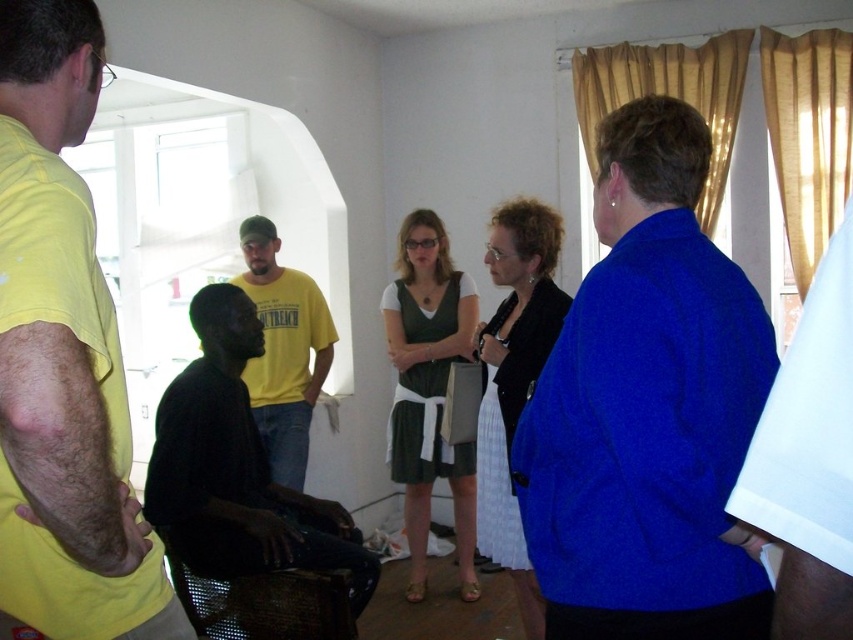
Is yellow matte shirt at left shorter than matte green dress at center?

Indeed, yellow matte shirt at left has a lesser height compared to matte green dress at center.

Is yellow matte shirt at left positioned at the back of matte green dress at center?

No, yellow matte shirt at left is in front of matte green dress at center.

Which is in front, point (38, 600) or point (399, 356)?

Positioned in front is point (38, 600).

This screenshot has height=640, width=853. What are the coordinates of `yellow matte shirt at left` in the screenshot? It's located at (62, 356).

Between black satin blouse at center and yellow cotton t-shirt at center, which one appears on the right side from the viewer's perspective?

Positioned to the right is black satin blouse at center.

Between point (523, 348) and point (263, 243), which one is positioned behind?

Positioned behind is point (263, 243).

Identify the location of black satin blouse at center. The height and width of the screenshot is (640, 853). (514, 378).

Is point (32, 577) positioned behind point (263, 500)?

No, (32, 577) is closer to viewer.

The image size is (853, 640). I want to click on yellow matte shirt at left, so click(x=62, y=356).